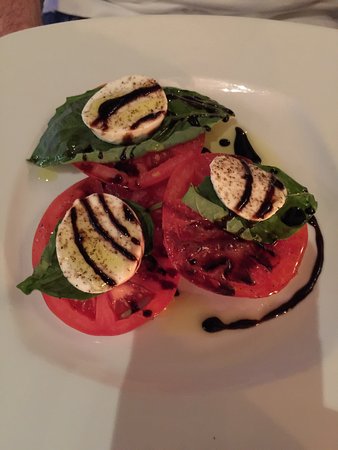
You are a GUI agent. You are given a task and a screenshot of the screen. Output one action in this format:
    pyautogui.click(x=<x>, y=<y>)
    Task: Click on the table
    The width and height of the screenshot is (338, 450).
    Given the screenshot: What is the action you would take?
    pyautogui.click(x=19, y=6)